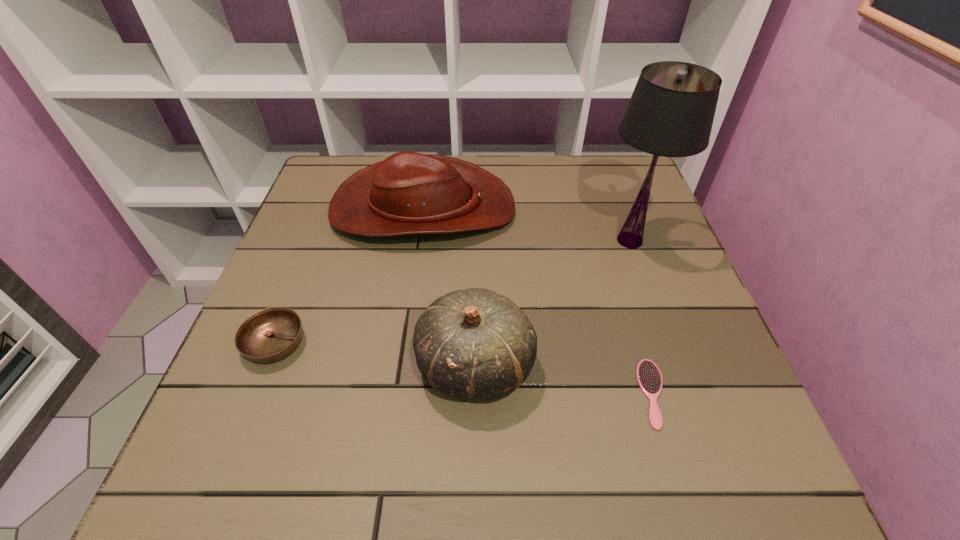
Where is `vacant area that lies between the tallest object and the third shortest object`? The height and width of the screenshot is (540, 960). vacant area that lies between the tallest object and the third shortest object is located at coordinates (527, 225).

You are a GUI agent. You are given a task and a screenshot of the screen. Output one action in this format:
    pyautogui.click(x=<x>, y=<y>)
    Task: Click on the free space between the gourd and the soup bowl
    This screenshot has width=960, height=540.
    Given the screenshot: What is the action you would take?
    pyautogui.click(x=375, y=354)

Where is `object that ranks as the fourth closest to the cowboy hat`? object that ranks as the fourth closest to the cowboy hat is located at coordinates (649, 378).

Locate which object is the third closest to the second shortest object. Please provide its 2D coordinates. Your answer should be formatted as a tuple, i.e. [(x, y)], where the tuple contains the x and y coordinates of a point satisfying the conditions above.

[(649, 378)]

Where is `blank space that satisfies the following two spatial constraints: 1. on the front-facing side of the cowboy hat; 2. on the left side of the shortest object`? blank space that satisfies the following two spatial constraints: 1. on the front-facing side of the cowboy hat; 2. on the left side of the shortest object is located at coordinates (396, 394).

Find the location of a particular element. The image size is (960, 540). vacant space that satisfies the following two spatial constraints: 1. on the front side of the gourd; 2. on the right side of the second shortest object is located at coordinates (267, 364).

Locate an element on the screen. This screenshot has height=540, width=960. free space that satisfies the following two spatial constraints: 1. on the front side of the fourth shortest object; 2. on the left side of the soup bowl is located at coordinates (267, 364).

Find the location of a particular element. Image resolution: width=960 pixels, height=540 pixels. vacant space that satisfies the following two spatial constraints: 1. on the front-facing side of the third shortest object; 2. on the back side of the hairbrush is located at coordinates [396, 394].

At what (x,y) coordinates should I click in order to perform the action: click on vacant position in the image that satisfies the following two spatial constraints: 1. on the back side of the second tallest object; 2. on the front-facing side of the third shortest object. Please return your answer as a coordinate pair (x, y). The height and width of the screenshot is (540, 960). Looking at the image, I should click on (476, 208).

Locate an element on the screen. vacant space that satisfies the following two spatial constraints: 1. on the back side of the gourd; 2. on the front-facing side of the third tallest object is located at coordinates (476, 208).